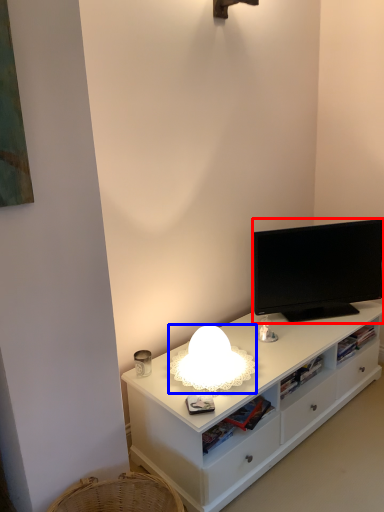
Question: Which of the following is the closest to the observer, television (highlighted by a red box) or lamp (highlighted by a blue box)?

Choices:
 (A) television
 (B) lamp

Answer: (B)